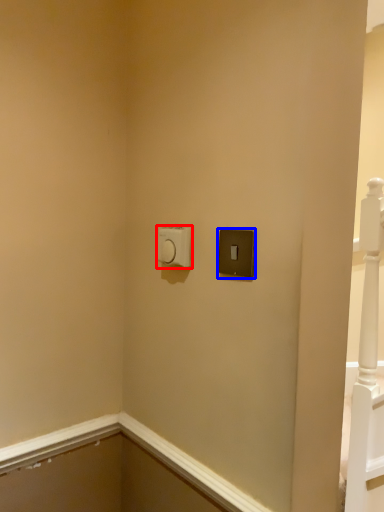
Question: Which of the following is the closest to the observer, light switch (highlighted by a red box) or light switch (highlighted by a blue box)?

Choices:
 (A) light switch
 (B) light switch

Answer: (B)